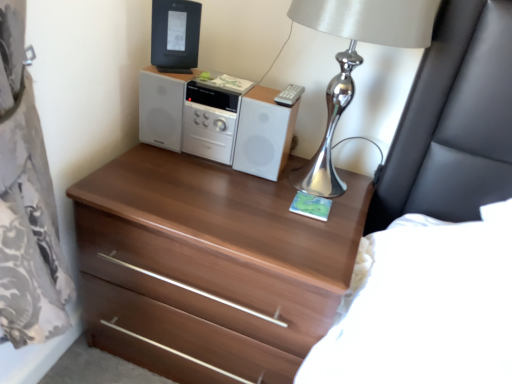
What do you see at coordinates (175, 35) in the screenshot? I see `black plastic desktop computer at upper center` at bounding box center [175, 35].

This screenshot has width=512, height=384. Describe the element at coordinates (216, 122) in the screenshot. I see `white glossy stereo at center` at that location.

What do you see at coordinates (354, 63) in the screenshot? I see `silver metallic table lamp at upper right` at bounding box center [354, 63].

The width and height of the screenshot is (512, 384). What are the coordinates of `walnut wood chest of drawers at center` in the screenshot? It's located at (210, 266).

Which is closer, (331, 145) or (141, 265)?

Point (331, 145) is positioned farther from the camera compared to point (141, 265).

Based on their sizes in the image, would you say silver metallic table lamp at upper right is bigger or smaller than walnut wood chest of drawers at center?

Clearly, silver metallic table lamp at upper right is smaller in size than walnut wood chest of drawers at center.

Looking at this image, is silver metallic table lamp at upper right wider than walnut wood chest of drawers at center?

No, silver metallic table lamp at upper right is not wider than walnut wood chest of drawers at center.

Considering the relative sizes of white glossy stereo at center and silver metallic table lamp at upper right in the image provided, is white glossy stereo at center shorter than silver metallic table lamp at upper right?

Indeed, white glossy stereo at center has a lesser height compared to silver metallic table lamp at upper right.

Which is more to the left, white glossy stereo at center or silver metallic table lamp at upper right?

Positioned to the left is white glossy stereo at center.

Considering the sizes of objects white glossy stereo at center and silver metallic table lamp at upper right in the image provided, who is wider, white glossy stereo at center or silver metallic table lamp at upper right?

silver metallic table lamp at upper right.

Is white glossy stereo at center located outside silver metallic table lamp at upper right?

Absolutely, white glossy stereo at center is external to silver metallic table lamp at upper right.

Can you confirm if black plastic desktop computer at upper center is taller than white glossy stereo at center?

No, black plastic desktop computer at upper center is not taller than white glossy stereo at center.

Considering the relative positions of black plastic desktop computer at upper center and white glossy stereo at center in the image provided, is black plastic desktop computer at upper center to the left of white glossy stereo at center from the viewer's perspective?

Yes.

Looking at their sizes, would you say black plastic desktop computer at upper center is wider or thinner than white glossy stereo at center?

Clearly, black plastic desktop computer at upper center has less width compared to white glossy stereo at center.

From a real-world perspective, is black plastic desktop computer at upper center physically below white glossy stereo at center?

Incorrect, from a real-world perspective, black plastic desktop computer at upper center is higher than white glossy stereo at center.

From a real-world perspective, which object rests below the other?

From a 3D spatial view, walnut wood chest of drawers at center is below.

Is walnut wood chest of drawers at center next to white glossy stereo at center?

walnut wood chest of drawers at center is not next to white glossy stereo at center, and they're not touching.

Does walnut wood chest of drawers at center have a greater width compared to white glossy stereo at center?

Correct, the width of walnut wood chest of drawers at center exceeds that of white glossy stereo at center.

This screenshot has height=384, width=512. What are the coordinates of `stereo above the walnut wood chest of drawers at center (from the image's perspective)` in the screenshot? It's located at [x=216, y=122].

Is black plastic desktop computer at upper center facing away from walnut wood chest of drawers at center?

black plastic desktop computer at upper center does not have its back to walnut wood chest of drawers at center.

Which is in front, black plastic desktop computer at upper center or walnut wood chest of drawers at center?

walnut wood chest of drawers at center is more forward.

Is black plastic desktop computer at upper center not within walnut wood chest of drawers at center?

Yes, black plastic desktop computer at upper center is located beyond the bounds of walnut wood chest of drawers at center.

This screenshot has width=512, height=384. I want to click on the chest of drawers below the black plastic desktop computer at upper center (from the image's perspective), so click(210, 266).

In the scene shown: Which object is positioned more to the left, silver metallic table lamp at upper right or white glossy stereo at center?

Positioned to the left is white glossy stereo at center.

Do you think silver metallic table lamp at upper right is within white glossy stereo at center, or outside of it?

silver metallic table lamp at upper right is not enclosed by white glossy stereo at center.

Is silver metallic table lamp at upper right with white glossy stereo at center?

There is a gap between silver metallic table lamp at upper right and white glossy stereo at center.

Who is taller, silver metallic table lamp at upper right or black plastic desktop computer at upper center?

Standing taller between the two is silver metallic table lamp at upper right.

Which object is further away from the camera, silver metallic table lamp at upper right or black plastic desktop computer at upper center?

black plastic desktop computer at upper center.

Find the location of a particular element. The image size is (512, 384). the chest of drawers that is under the silver metallic table lamp at upper right (from a real-world perspective) is located at coordinates (210, 266).

Locate an element on the screen. stereo on the left of silver metallic table lamp at upper right is located at coordinates (216, 122).

From the image, which object appears to be nearer to silver metallic table lamp at upper right, white glossy stereo at center or black plastic desktop computer at upper center?

white glossy stereo at center lies closer to silver metallic table lamp at upper right than the other object.

In the scene shown: When comparing their distances from silver metallic table lamp at upper right, does black plastic desktop computer at upper center or white glossy stereo at center seem further?

black plastic desktop computer at upper center is positioned further to the anchor silver metallic table lamp at upper right.

Estimate the real-world distances between objects in this image. Which object is closer to white glossy stereo at center, black plastic desktop computer at upper center or walnut wood chest of drawers at center?

black plastic desktop computer at upper center is closer to white glossy stereo at center.

Considering their positions, is walnut wood chest of drawers at center positioned further to white glossy stereo at center than black plastic desktop computer at upper center?

walnut wood chest of drawers at center.

Considering their positions, is white glossy stereo at center positioned closer to black plastic desktop computer at upper center than walnut wood chest of drawers at center?

white glossy stereo at center lies closer to black plastic desktop computer at upper center than the other object.

Based on their spatial positions, is walnut wood chest of drawers at center or white glossy stereo at center closer to silver metallic table lamp at upper right?

white glossy stereo at center is positioned closer to the anchor silver metallic table lamp at upper right.

Looking at the image, which one is located further to white glossy stereo at center, silver metallic table lamp at upper right or black plastic desktop computer at upper center?

silver metallic table lamp at upper right.

Based on their spatial positions, is black plastic desktop computer at upper center or silver metallic table lamp at upper right further from white glossy stereo at center?

silver metallic table lamp at upper right lies further to white glossy stereo at center than the other object.

In order to click on stereo between black plastic desktop computer at upper center and walnut wood chest of drawers at center in the vertical direction in this screenshot , I will do `click(216, 122)`.

Where is `table lamp between black plastic desktop computer at upper center and walnut wood chest of drawers at center vertically`? This screenshot has width=512, height=384. table lamp between black plastic desktop computer at upper center and walnut wood chest of drawers at center vertically is located at coordinates (354, 63).

Where is `stereo that lies between silver metallic table lamp at upper right and walnut wood chest of drawers at center from top to bottom`? stereo that lies between silver metallic table lamp at upper right and walnut wood chest of drawers at center from top to bottom is located at coordinates (216, 122).

The height and width of the screenshot is (384, 512). Find the location of `stereo located between black plastic desktop computer at upper center and silver metallic table lamp at upper right in the left-right direction`. stereo located between black plastic desktop computer at upper center and silver metallic table lamp at upper right in the left-right direction is located at coordinates (216, 122).